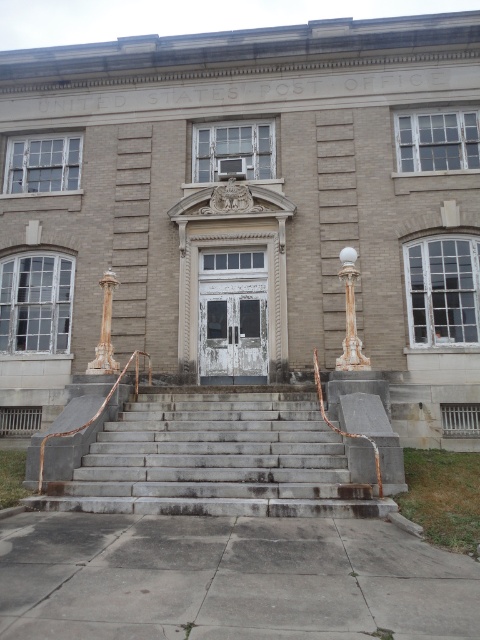
Question: Which of the following is the closest to the observer?

Choices:
 (A) marble column at left
 (B) gray concrete stairs at center
 (C) white marble column at center

Answer: (B)

Question: Is gray concrete stairs at center smaller than marble column at left?

Choices:
 (A) no
 (B) yes

Answer: (A)

Question: Which object appears farthest from the camera in this image?

Choices:
 (A) gray concrete stairs at center
 (B) marble column at left
 (C) white marble column at center

Answer: (B)

Question: Is the position of white marble column at center more distant than that of marble column at left?

Choices:
 (A) no
 (B) yes

Answer: (A)

Question: Which is farther from the marble column at left?

Choices:
 (A) white marble column at center
 (B) gray concrete stairs at center

Answer: (A)

Question: Considering the relative positions of gray concrete stairs at center and marble column at left in the image provided, where is gray concrete stairs at center located with respect to marble column at left?

Choices:
 (A) below
 (B) above

Answer: (A)